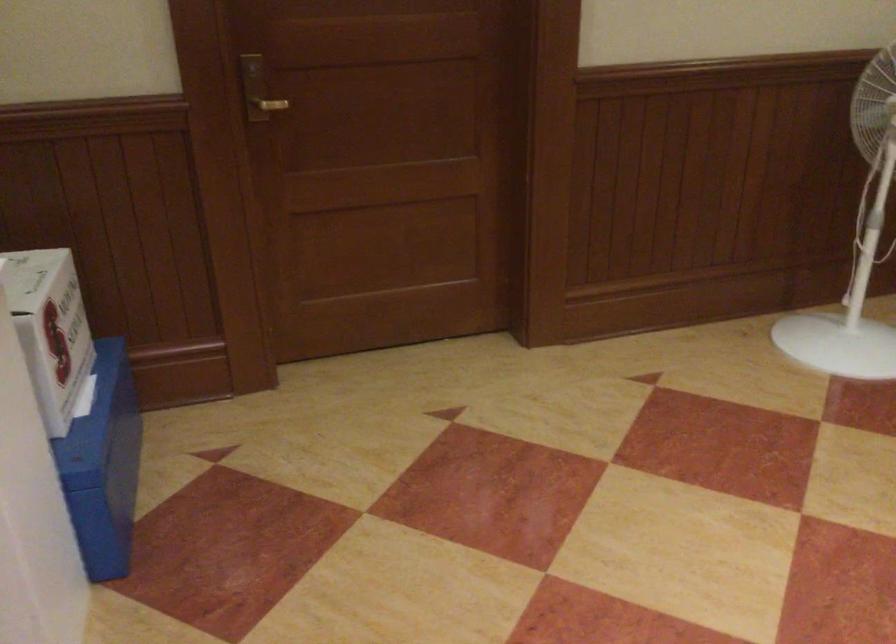
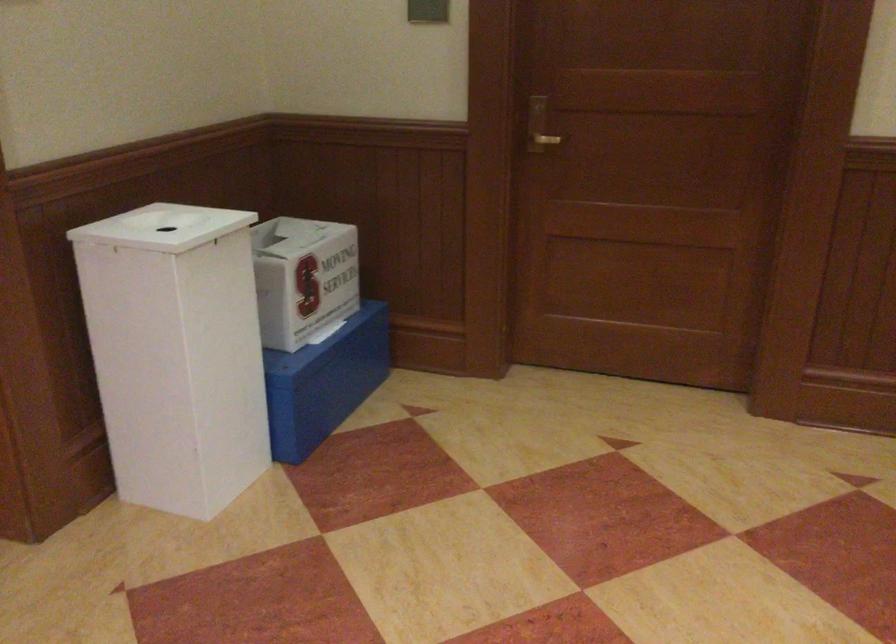
Where in the second image is the point corresponding to the point at 115,458 from the first image?

(323, 382)